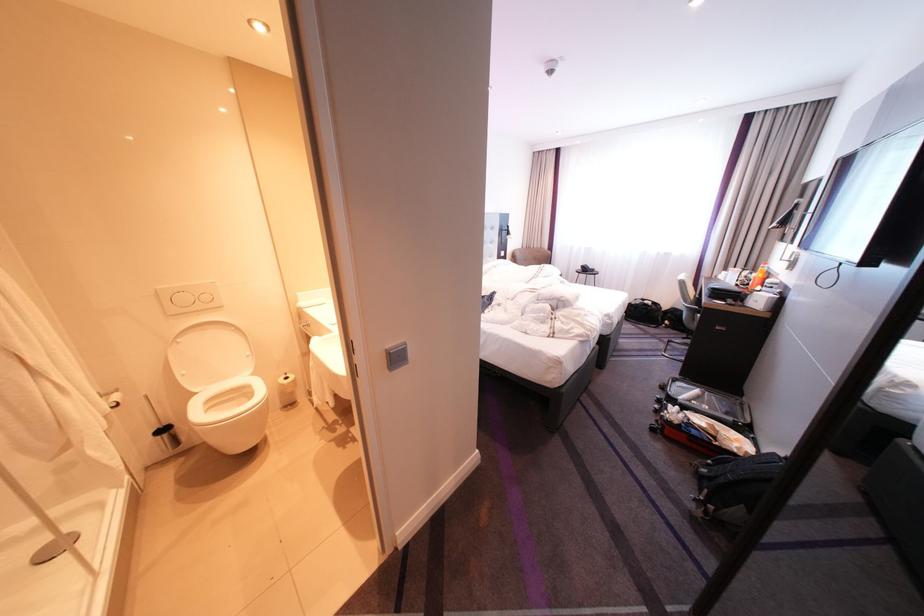
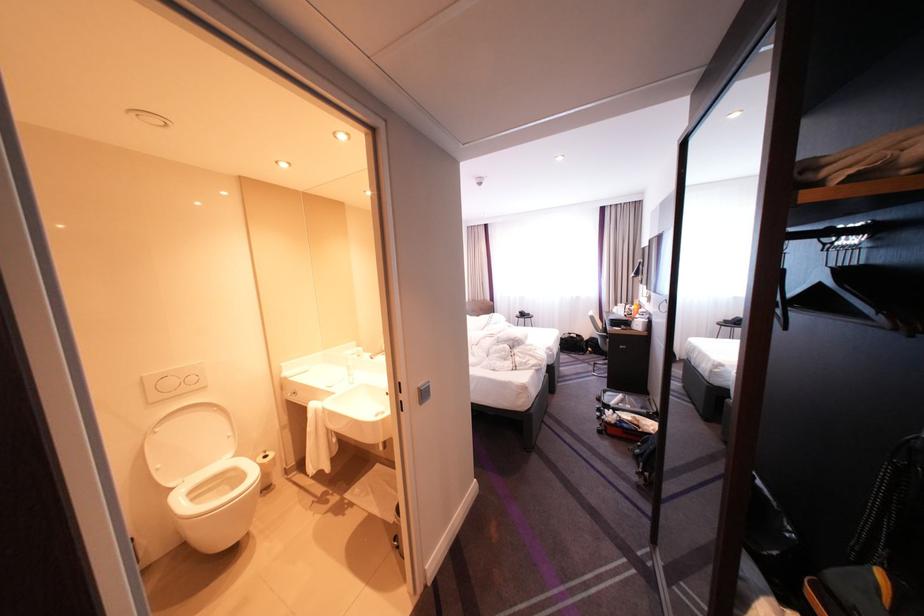
The point at (293, 377) is marked in the first image. Where is the corresponding point in the second image?

(271, 456)